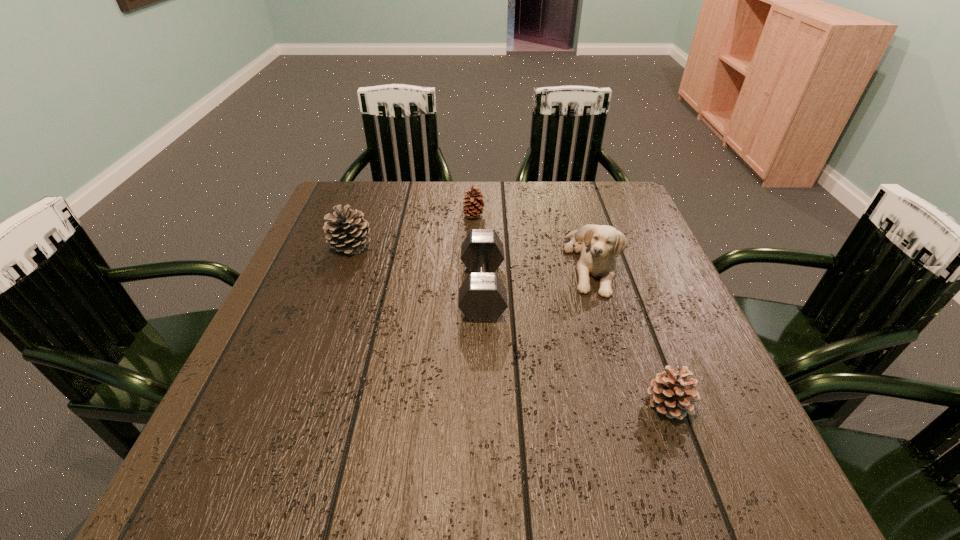
Image resolution: width=960 pixels, height=540 pixels. In the image, there is a desktop. What are the coordinates of `free region at the right edge` in the screenshot? It's located at (681, 305).

The width and height of the screenshot is (960, 540). Find the location of `vacant space at the near left corner of the desktop`. vacant space at the near left corner of the desktop is located at coordinates (272, 464).

You are a GUI agent. You are given a task and a screenshot of the screen. Output one action in this format:
    pyautogui.click(x=<x>, y=<y>)
    Task: Click on the free space at the far right corner
    This screenshot has width=960, height=540.
    Given the screenshot: What is the action you would take?
    pyautogui.click(x=623, y=220)

You are a GUI agent. You are given a task and a screenshot of the screen. Output one action in this format:
    pyautogui.click(x=<x>, y=<y>)
    Task: Click on the blank region between the dumbbell and the leftmost object
    This screenshot has width=960, height=540.
    Given the screenshot: What is the action you would take?
    pyautogui.click(x=417, y=267)

This screenshot has height=540, width=960. I want to click on free area in between the nearest pinecone and the second farthest pinecone, so point(510,325).

At what (x,y) coordinates should I click in order to perform the action: click on empty location between the dumbbell and the puppy. Please return your answer as a coordinate pair (x, y). The image size is (960, 540). Looking at the image, I should click on (537, 276).

Image resolution: width=960 pixels, height=540 pixels. Identify the location of free spot between the leftmost object and the farthest object. (413, 231).

Identify the location of free point between the leftmost pinecone and the farthest object. The height and width of the screenshot is (540, 960). click(x=413, y=231).

You are a GUI agent. You are given a task and a screenshot of the screen. Output one action in this format:
    pyautogui.click(x=<x>, y=<y>)
    Task: Click on the vacant point located between the rightmost pinecone and the dumbbell
    
    Given the screenshot: What is the action you would take?
    pyautogui.click(x=576, y=347)

What are the coordinates of `free space between the nearest pinecone and the dumbbell` in the screenshot? It's located at (576, 347).